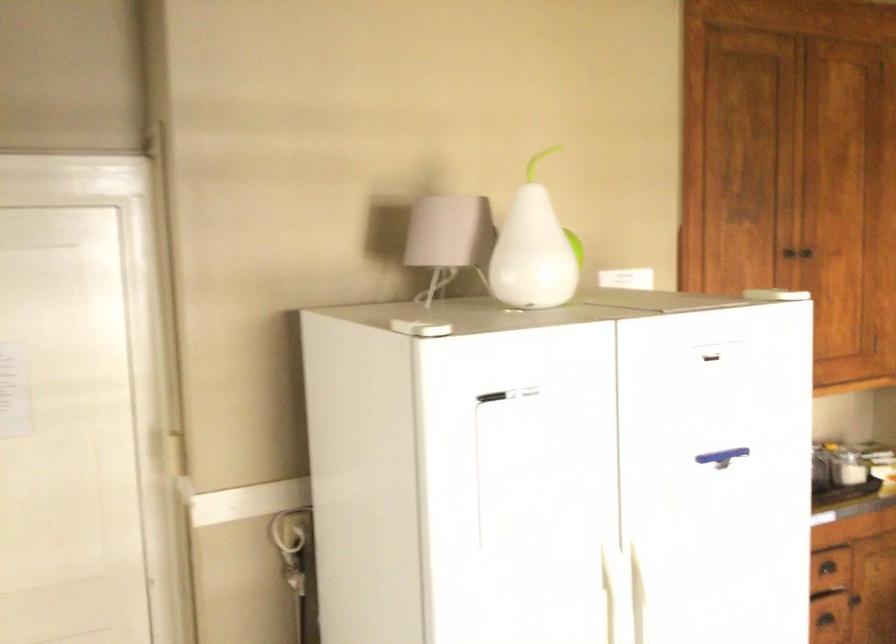
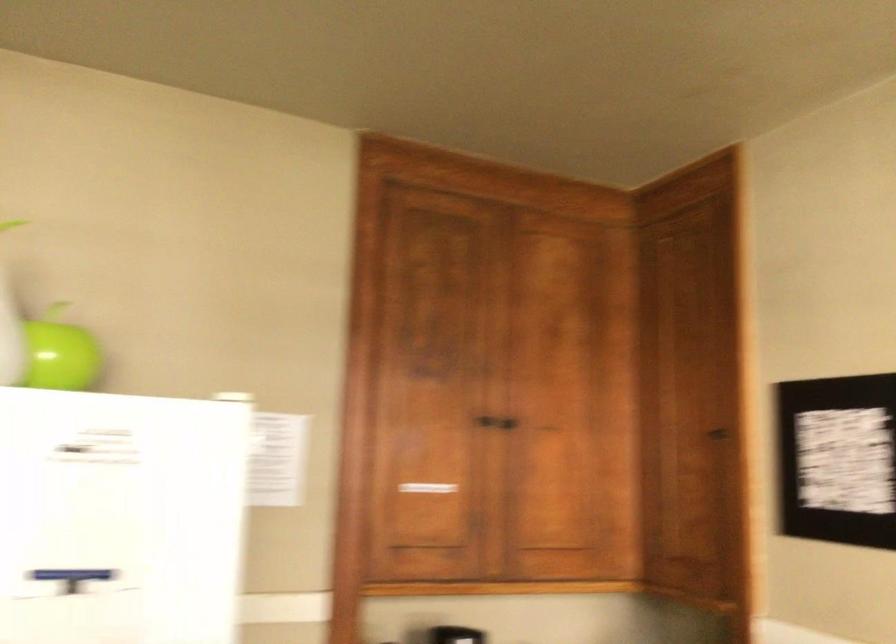
Find the pixel in the second image that matches the point at 821,252 in the first image.

(511, 419)